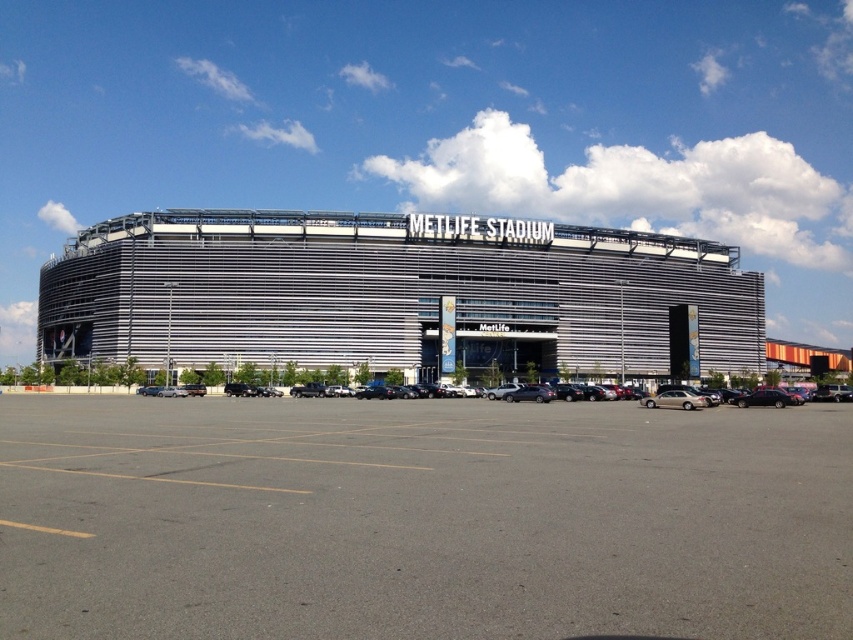
Question: Does gray asphalt parking lot at center appear on the right side of gold metallic sedan at center?

Choices:
 (A) yes
 (B) no

Answer: (B)

Question: Is metallic silver stadium at center closer to the viewer compared to gold metallic sedan at center?

Choices:
 (A) no
 (B) yes

Answer: (A)

Question: Considering the real-world distances, which object is farthest from the gray asphalt parking lot at center?

Choices:
 (A) metallic silver stadium at center
 (B) gold metallic sedan at center

Answer: (A)

Question: Can you confirm if gray asphalt parking lot at center is positioned above metallic silver stadium at center?

Choices:
 (A) yes
 (B) no

Answer: (B)

Question: Which point is closer to the camera?

Choices:
 (A) (724, 332)
 (B) (132, 451)
 (C) (679, 397)

Answer: (B)

Question: Which point appears farthest from the camera in this image?

Choices:
 (A) (822, 636)
 (B) (439, 241)

Answer: (B)